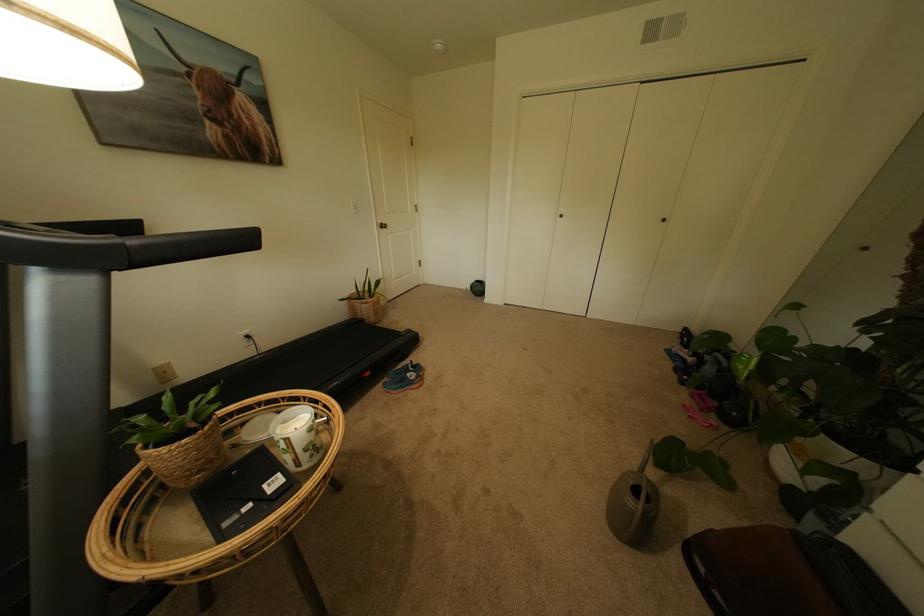
Find the location of a particular element. black picture frame is located at coordinates (186, 95).